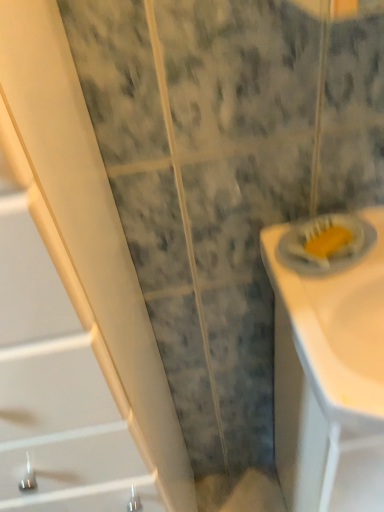
Question: Should I look upward or downward to see white glossy sink at right?

Choices:
 (A) down
 (B) up

Answer: (A)